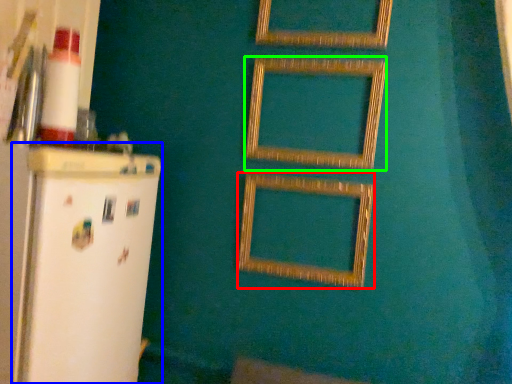
Question: Estimate the real-world distances between objects in this image. Which object is closer to picture frame (highlighted by a red box), fridge (highlighted by a blue box) or picture frame (highlighted by a green box)?

Choices:
 (A) fridge
 (B) picture frame

Answer: (B)